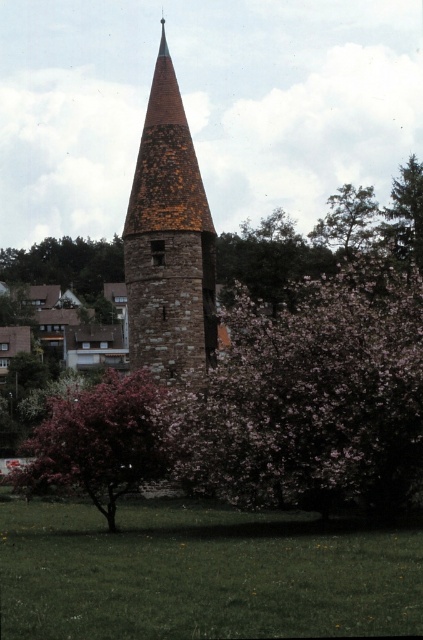
You are standing in front of the historic stone tower and want to take a photo. There are two points marked on the tower at coordinates point (176, 252) and point (87, 252). Which point is closer to your camera when you take the photo?

Point (176, 252) is closer to the camera than point (87, 252).

You are standing in front of the historic stone tower and want to take a photo. You notice two points marked in the scene. The first point is at coordinates point (x=63, y=256) and the second point is at point (x=403, y=224). Which point is closer to your camera lens?

Point (x=63, y=256) is further to the camera than point (x=403, y=224). Therefore, the point closer to your camera lens is point (x=403, y=224).

You are standing in a park and see the brown stone tower at center and the pink blossoming bush at center. Which object is positioned to the right of the other?

The brown stone tower at center is to the right of the pink blossoming bush at center.